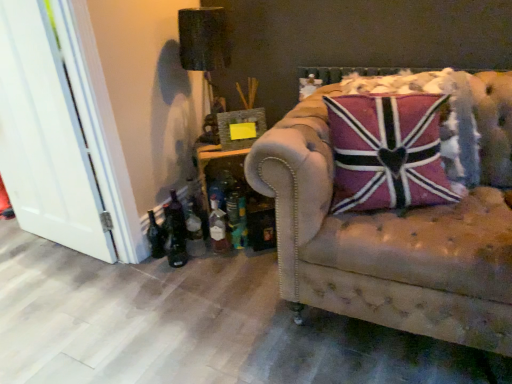
Where is `vacant point to the left of leather tufted couch at right`? vacant point to the left of leather tufted couch at right is located at coordinates (211, 313).